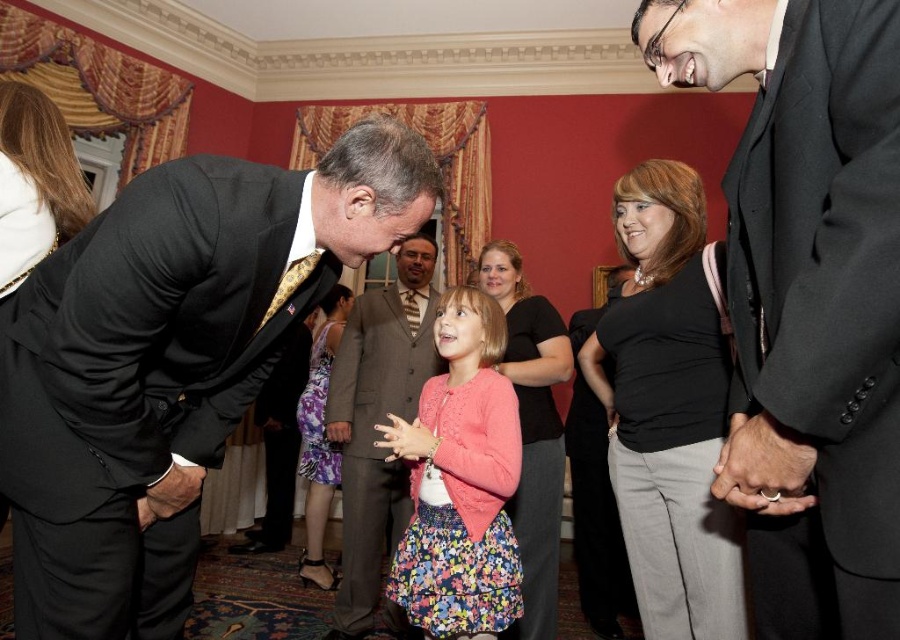
You are a photographer at this event and need to position a spotlight on the pink fabric dress at center and the matte brown suit at center. Based on their positions, which object should you adjust the spotlight to the right to illuminate?

The pink fabric dress at center is to the right of the matte brown suit at center, so you should adjust the spotlight to the right to illuminate the pink fabric dress at center.